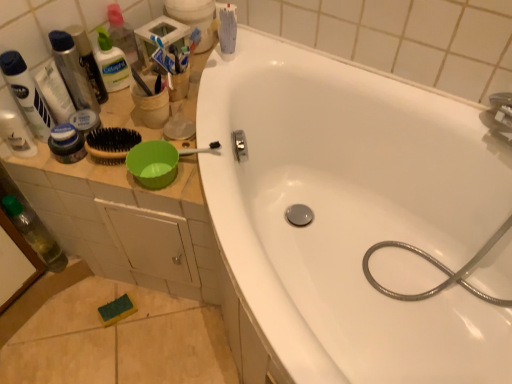
This screenshot has width=512, height=384. What are the coordinates of `empty space that is to the right of translucent plastic bottle at upper left, placed as the fourth toiletry when sorted from right to left` in the screenshot? It's located at (99, 157).